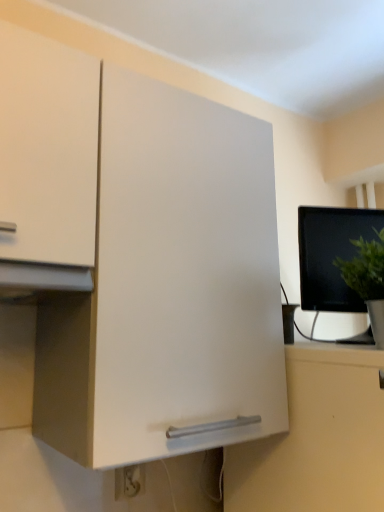
Question: In the image, is black glossy monitor at right positioned in front of or behind green matte plant at right?

Choices:
 (A) behind
 (B) front

Answer: (A)

Question: Is point (337, 252) positioned closer to the camera than point (362, 269)?

Choices:
 (A) closer
 (B) farther

Answer: (B)

Question: Which of these objects is positioned closest to the white plastic electric outlet at lower center?

Choices:
 (A) black glossy monitor at right
 (B) green matte plant at right

Answer: (B)

Question: Which is nearer to the white plastic electric outlet at lower center?

Choices:
 (A) black glossy monitor at right
 (B) green matte plant at right

Answer: (B)